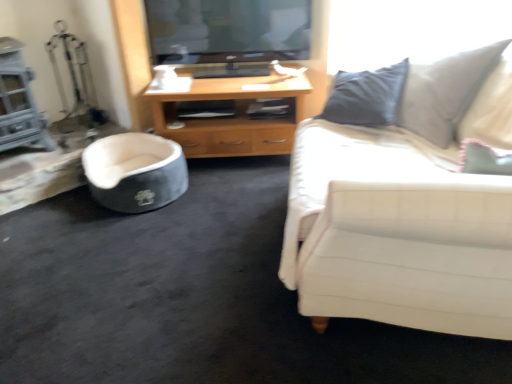
Question: Is soft gray fabric pet bed at lower left taller or shorter than white fabric couch at right?

Choices:
 (A) tall
 (B) short

Answer: (B)

Question: Is point (126, 168) closer or farther from the camera than point (502, 74)?

Choices:
 (A) closer
 (B) farther

Answer: (B)

Question: Estimate the real-world distances between objects in this image. Which object is closer to the white fabric couch at right?

Choices:
 (A) wooden cabinet at center
 (B) soft gray fabric pet bed at lower left

Answer: (A)

Question: Which object is the farthest from the white fabric couch at right?

Choices:
 (A) soft gray fabric pet bed at lower left
 (B) wooden cabinet at center

Answer: (A)